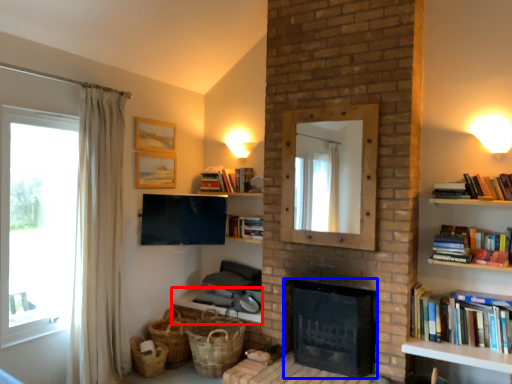
Question: Among these objects, which one is farthest to the camera, table (highlighted by a red box) or fireplace (highlighted by a blue box)?

Choices:
 (A) table
 (B) fireplace

Answer: (A)